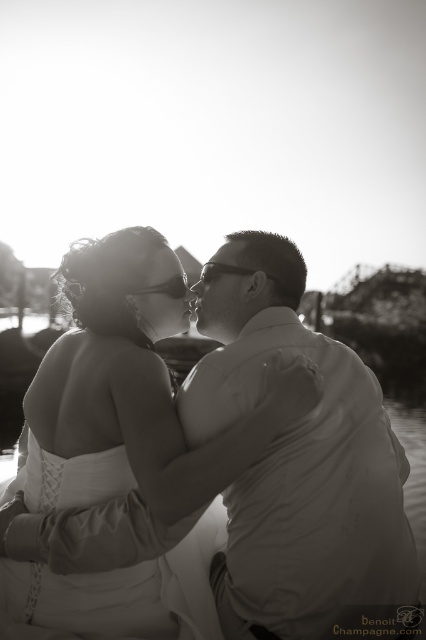
Can you confirm if smooth cotton shirt at right is thinner than white satin dress at center?

Yes, smooth cotton shirt at right is thinner than white satin dress at center.

Is point (198, 424) farther from viewer compared to point (158, 317)?

No, it is in front of (158, 317).

This screenshot has width=426, height=640. I want to click on smooth cotton shirt at right, so click(296, 461).

This screenshot has width=426, height=640. What do you see at coordinates (296, 461) in the screenshot? I see `smooth cotton shirt at right` at bounding box center [296, 461].

Which is behind, point (270, 294) or point (241, 252)?

The point (241, 252) is more distant.

Identify the location of smooth cotton shirt at right. Image resolution: width=426 pixels, height=640 pixels. (296, 461).

Who is positioned more to the left, white satin dress at center or smooth skin forehead at center?

white satin dress at center

Measure the distance from white satin dress at center to smooth skin forehead at center.

They are 11.16 meters apart.

Locate an element on the screen. The height and width of the screenshot is (640, 426). white satin dress at center is located at coordinates (137, 385).